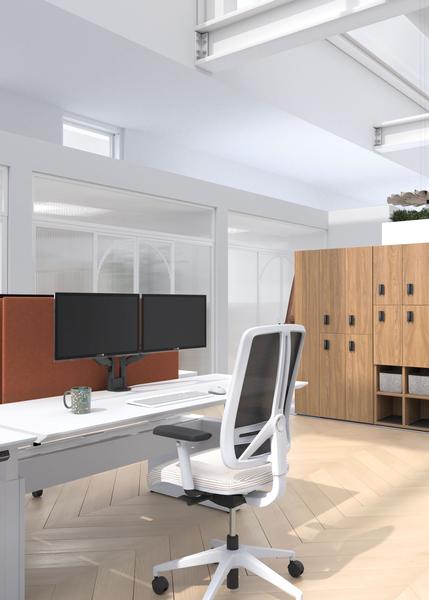
Identify the location of mug. The width and height of the screenshot is (429, 600). (82, 399).